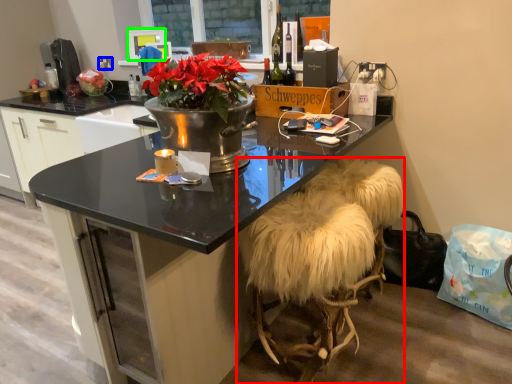
Question: Considering the real-world distances, which object is closest to stool (highlighted by a red box)? power outlet (highlighted by a blue box) or television (highlighted by a green box).

Choices:
 (A) power outlet
 (B) television

Answer: (B)